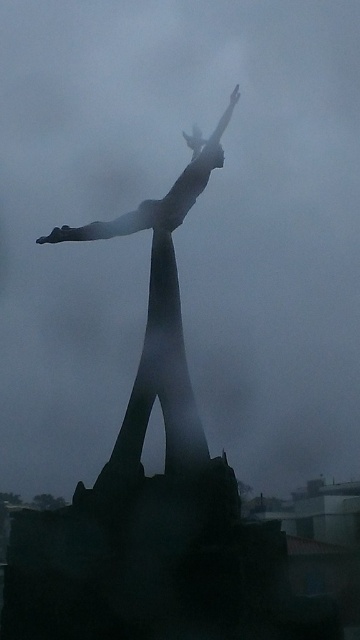
Where is `bronze statue at center`? This screenshot has height=640, width=360. bronze statue at center is located at coordinates (159, 323).

Can you confirm if bronze statue at center is positioned to the left of satin silver arm at center?

No, bronze statue at center is not to the left of satin silver arm at center.

Is point (183, 371) closer to camera compared to point (101, 227)?

Yes, it is.

The height and width of the screenshot is (640, 360). I want to click on bronze statue at center, so click(x=159, y=323).

Which is behind, point (74, 236) or point (219, 120)?

The point (219, 120) is behind.

Between satin silver arm at center and satin silver arm at upper center, which one has more height?

satin silver arm at upper center

Is point (79, 234) positioned after point (209, 138)?

That is False.

This screenshot has width=360, height=640. I want to click on satin silver arm at center, so [106, 225].

Does bronze statue at center appear under satin silver arm at upper center?

Indeed, bronze statue at center is positioned under satin silver arm at upper center.

I want to click on bronze statue at center, so click(159, 323).

Who is more forward, (167, 262) or (218, 125)?

Positioned in front is point (167, 262).

Find the location of a particular element. The image size is (360, 640). bronze statue at center is located at coordinates (159, 323).